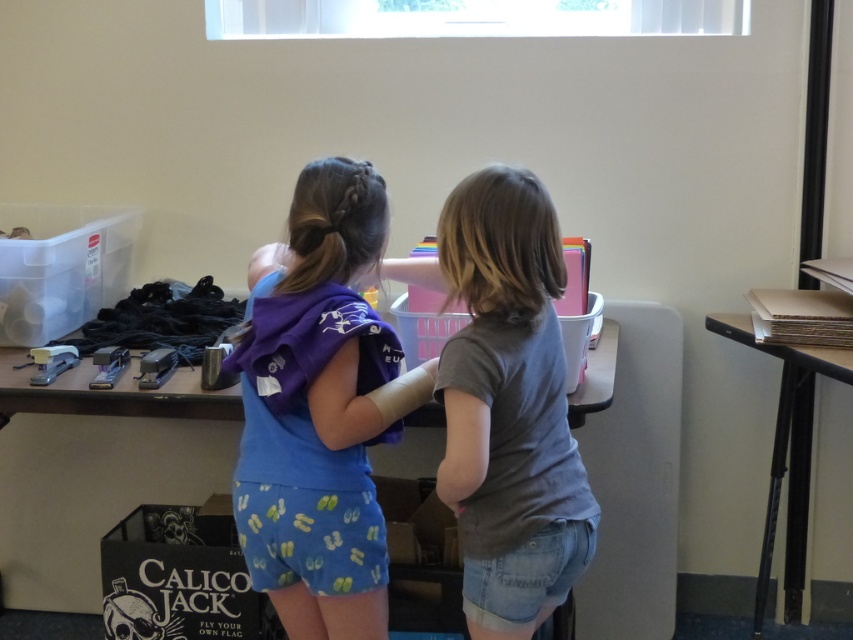
Question: Which object is farther from the camera taking this photo?

Choices:
 (A) wooden table at center
 (B) gray matte shirt at center
 (C) blue cotton shirt at center
 (D) smooth cardboard stack at right

Answer: (A)

Question: Can you confirm if blue cotton shirt at center is positioned below smooth cardboard stack at right?

Choices:
 (A) no
 (B) yes

Answer: (A)

Question: Which of these objects is positioned farthest from the smooth cardboard stack at right?

Choices:
 (A) gray matte shirt at center
 (B) blue cotton shirt at center
 (C) wooden table at center

Answer: (C)

Question: Can you confirm if blue cotton shirt at center is positioned to the right of wooden table at center?

Choices:
 (A) no
 (B) yes

Answer: (B)

Question: Is blue cotton shirt at center positioned at the back of gray matte shirt at center?

Choices:
 (A) yes
 (B) no

Answer: (A)

Question: Estimate the real-world distances between objects in this image. Which object is farther from the gray matte shirt at center?

Choices:
 (A) wooden table at center
 (B) blue cotton shirt at center

Answer: (A)